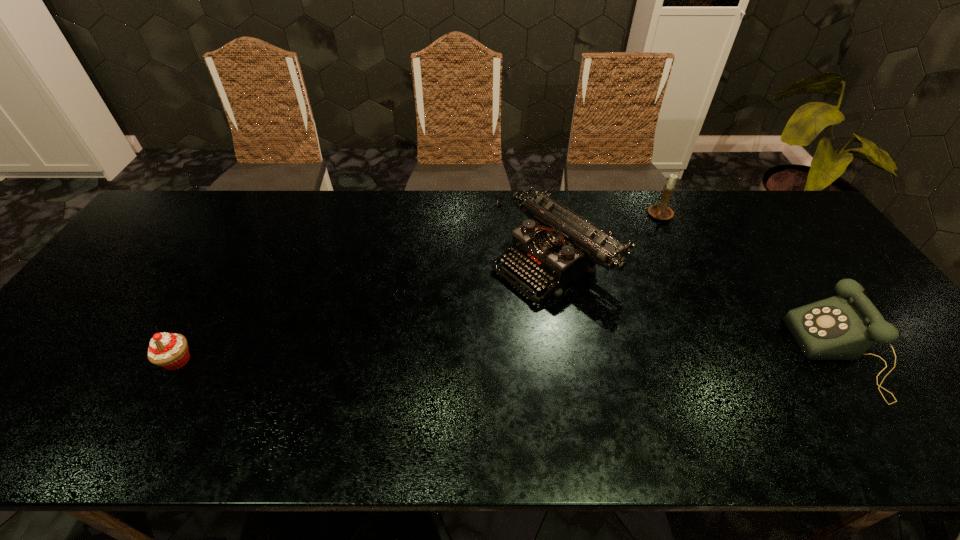
The width and height of the screenshot is (960, 540). In order to click on the shortest object in this screenshot , I will do `click(168, 350)`.

Image resolution: width=960 pixels, height=540 pixels. Identify the location of cupcake. (168, 350).

Locate an element on the screen. Image resolution: width=960 pixels, height=540 pixels. the rightmost object is located at coordinates (843, 327).

Locate an element on the screen. This screenshot has height=540, width=960. the second shortest object is located at coordinates (843, 327).

At what (x,y) coordinates should I click in order to perform the action: click on the second object from right to left. Please return your answer as a coordinate pair (x, y). Image resolution: width=960 pixels, height=540 pixels. Looking at the image, I should click on (661, 211).

Identify the location of typewriter. (556, 246).

Find the location of a particular element. The image size is (960, 540). free space located 0.080m on the right of the leftmost object is located at coordinates (228, 360).

The height and width of the screenshot is (540, 960). I want to click on vacant region located on the dial of the telephone, so click(x=670, y=354).

The height and width of the screenshot is (540, 960). In order to click on free space located 0.080m on the dial of the telephone in this screenshot , I will do `click(769, 354)`.

Locate an element on the screen. vacant area located 0.320m on the dial of the telephone is located at coordinates (670, 354).